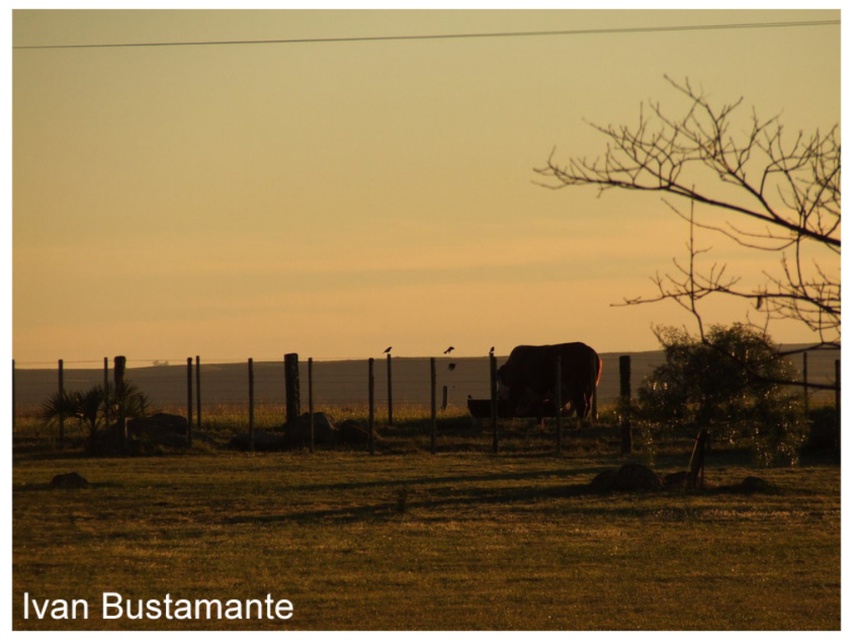
Question: Which object is positioned farthest from the green leafy tree at right?

Choices:
 (A) brown matte bull at center
 (B) brown bare branches at upper right
 (C) metallic wire fence at center

Answer: (C)

Question: Does brown bare branches at upper right have a smaller size compared to brown matte bull at center?

Choices:
 (A) yes
 (B) no

Answer: (B)

Question: Which of these objects is positioned farthest from the brown bare branches at upper right?

Choices:
 (A) brown matte bull at center
 (B) green leafy tree at right
 (C) metallic wire fence at center

Answer: (B)

Question: Which of these objects is positioned closest to the metallic wire fence at center?

Choices:
 (A) brown matte bull at center
 (B) brown bare branches at upper right
 (C) green leafy tree at right

Answer: (A)

Question: Does metallic wire fence at center have a smaller size compared to brown matte bull at center?

Choices:
 (A) no
 (B) yes

Answer: (A)

Question: Where is brown bare branches at upper right located in relation to metallic wire fence at center in the image?

Choices:
 (A) left
 (B) right

Answer: (B)